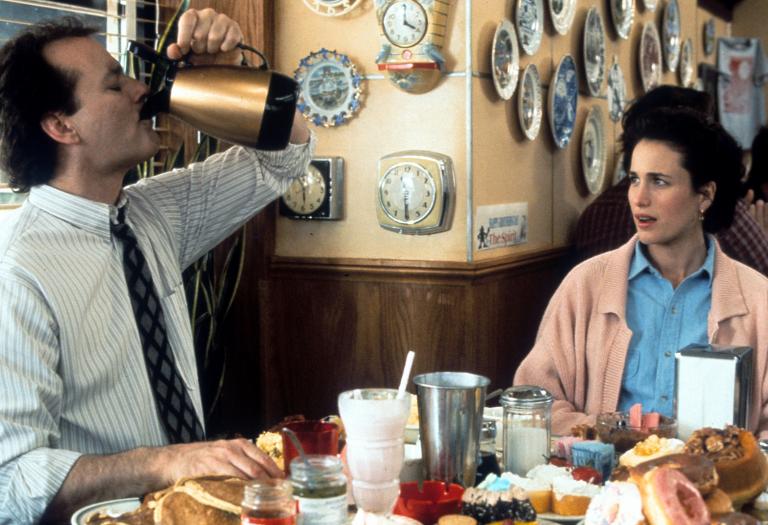
In order to click on dish in this screenshot , I will do `click(114, 505)`.